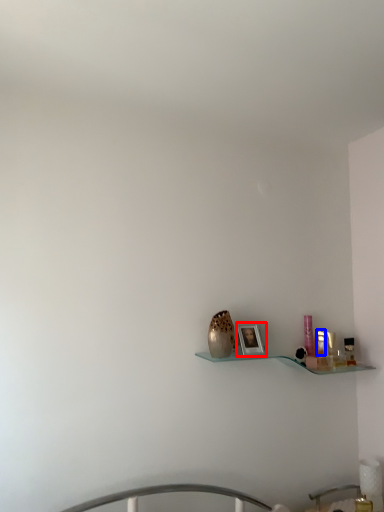
Question: Which object appears closest to the camera in this image, picture frame (highlighted by a red box) or toiletry (highlighted by a blue box)?

Choices:
 (A) picture frame
 (B) toiletry

Answer: (A)